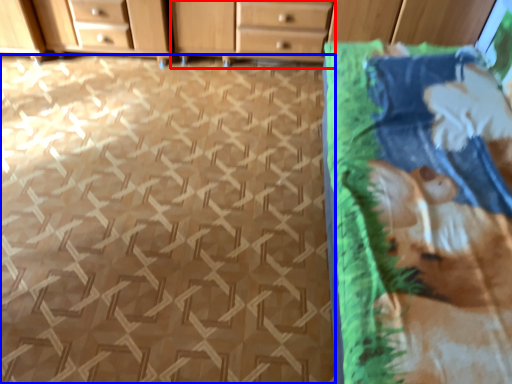
Question: Among these objects, which one is nearest to the camera, chest of drawers (highlighted by a red box) or tile (highlighted by a blue box)?

Choices:
 (A) chest of drawers
 (B) tile

Answer: (B)